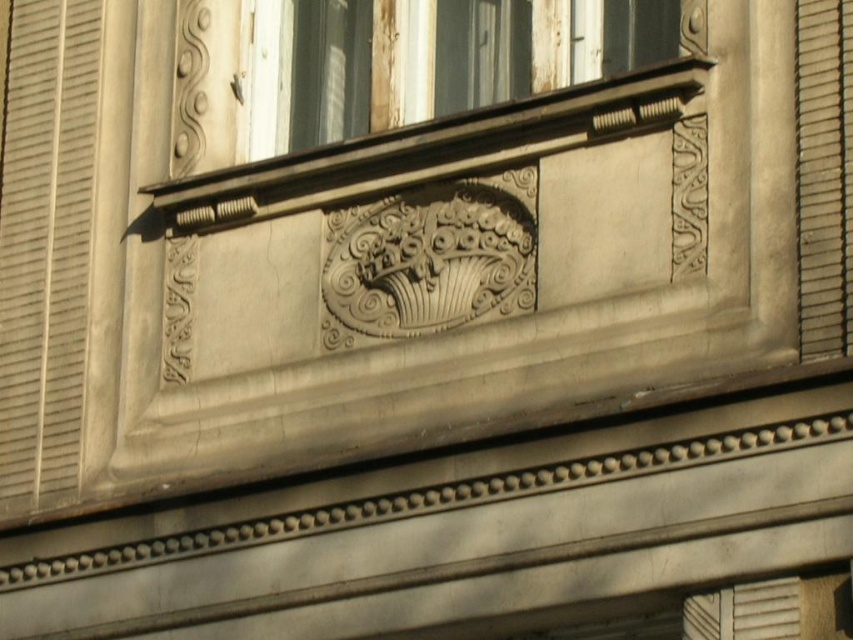
Image resolution: width=853 pixels, height=640 pixels. Describe the element at coordinates (45, 241) in the screenshot. I see `metallic silver shutter at left` at that location.

Does point (56, 77) come behind point (798, 163)?

Yes.

Where is `metallic silver shutter at left`? This screenshot has height=640, width=853. metallic silver shutter at left is located at coordinates (45, 241).

Is the position of metallic silver shutter at left more distant than that of white stone window sill at upper center?

Yes, metallic silver shutter at left is behind white stone window sill at upper center.

Does metallic silver shutter at left have a smaller size compared to white stone window sill at upper center?

Actually, metallic silver shutter at left might be larger than white stone window sill at upper center.

I want to click on metallic silver shutter at left, so click(x=45, y=241).

Looking at this image, does wooden window at upper center have a lesser width compared to white stone window sill at upper center?

Yes, wooden window at upper center is thinner than white stone window sill at upper center.

Find the location of a particular element. wooden window at upper center is located at coordinates (308, 74).

Does point (463, 81) come farther from viewer compared to point (355, 148)?

Yes.

Identify the location of wooden window at upper center. tap(308, 74).